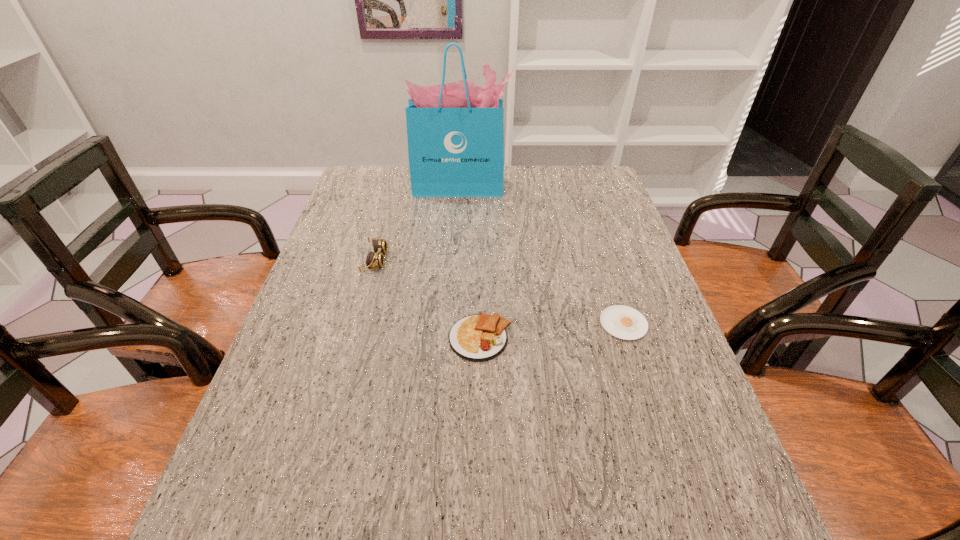
You are a GUI agent. You are given a task and a screenshot of the screen. Output one action in this format:
    pyautogui.click(x=<x>, y=<y>)
    Task: Click on the blank area located on the front of the shortest object
    The width and height of the screenshot is (960, 540).
    Given the screenshot: What is the action you would take?
    [x=658, y=431]

Image resolution: width=960 pixels, height=540 pixels. Find the location of `object present at the far edge`. object present at the far edge is located at coordinates (455, 131).

The height and width of the screenshot is (540, 960). I want to click on object present at the left edge, so click(375, 259).

Find the location of a particular element. The image size is (960, 540). object positioned at the right edge is located at coordinates (623, 322).

Locate an element on the screen. Image resolution: width=960 pixels, height=540 pixels. vacant space at the far edge of the desktop is located at coordinates (550, 186).

What are the coordinates of `vacant space at the near edge of the desktop` in the screenshot? It's located at (424, 524).

The width and height of the screenshot is (960, 540). In the image, there is a desktop. Find the location of `vacant space at the left edge`. vacant space at the left edge is located at coordinates (334, 328).

In the image, there is a desktop. What are the coordinates of `blank space at the right edge` in the screenshot? It's located at (656, 339).

In the image, there is a desktop. Where is `vacant space at the near left corner`? vacant space at the near left corner is located at coordinates (208, 539).

The height and width of the screenshot is (540, 960). I want to click on vacant space at the far right corner of the desktop, so click(570, 172).